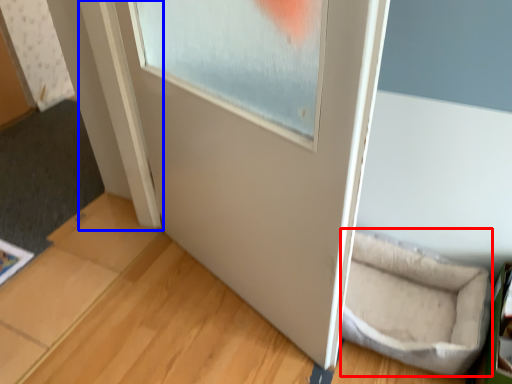
Question: Among these objects, which one is nearest to the camera, wide (highlighted by a red box) or window frame (highlighted by a blue box)?

Choices:
 (A) wide
 (B) window frame

Answer: (A)